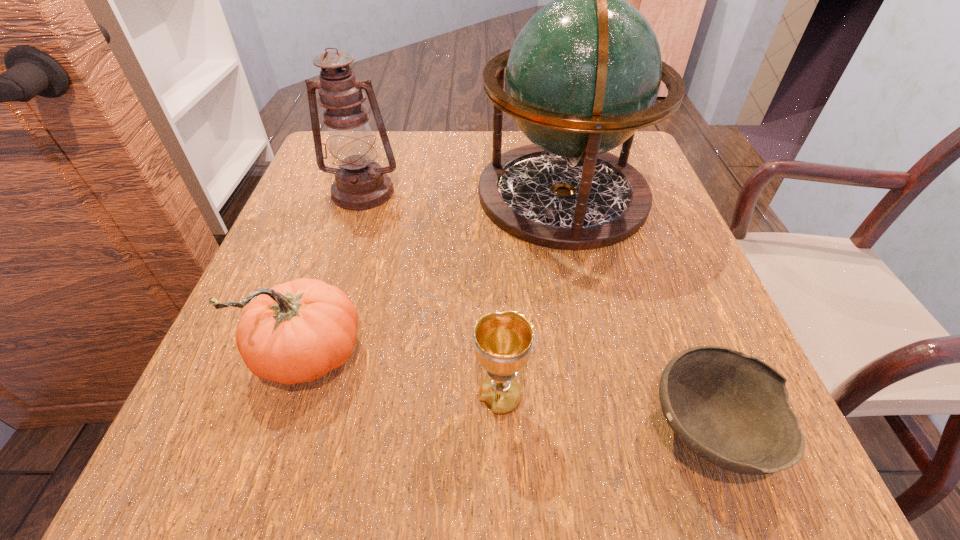
Identify the location of globe. (582, 76).

At what (x,y) coordinates should I click in order to perform the action: click on the second tallest object. Please return your answer as a coordinate pair (x, y). Looking at the image, I should click on (360, 183).

Image resolution: width=960 pixels, height=540 pixels. Find the location of `the third shortest object`. the third shortest object is located at coordinates (294, 332).

Where is `chalice`? chalice is located at coordinates (503, 341).

At what (x,y) coordinates should I click in order to perform the action: click on bowl. Please return your answer as a coordinate pair (x, y). This screenshot has width=960, height=540. Looking at the image, I should click on click(731, 409).

Locate an element on the screen. free region located 0.260m on the front-facing side of the globe is located at coordinates (357, 194).

This screenshot has height=540, width=960. What are the coordinates of `vacant space located on the front-facing side of the globe` in the screenshot? It's located at (311, 194).

Locate an element on the screen. This screenshot has height=540, width=960. free spot located on the front-facing side of the globe is located at coordinates (427, 194).

Where is `vacant region located 0.390m on the right of the fourth shortest object`? The height and width of the screenshot is (540, 960). vacant region located 0.390m on the right of the fourth shortest object is located at coordinates (581, 192).

Locate an element on the screen. vacant region located 0.380m on the back of the third tallest object is located at coordinates (365, 181).